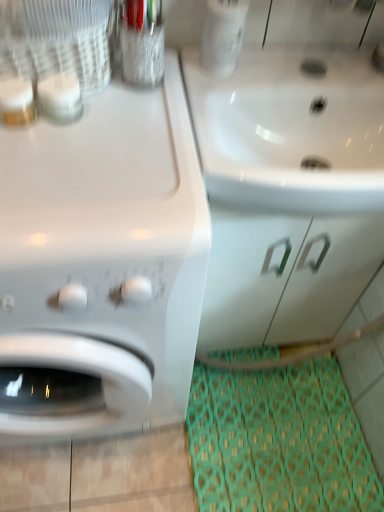
Question: Does point (225, 440) appear closer or farther from the camera than point (74, 367)?

Choices:
 (A) farther
 (B) closer

Answer: (A)

Question: From the image's perspective, is green fabric doormat at lower right above or below white glossy washing machine at left?

Choices:
 (A) below
 (B) above

Answer: (A)

Question: Considering the real-world distances, which object is farthest from the white glossy drawer at center?

Choices:
 (A) green fabric doormat at lower right
 (B) white glossy sink at upper right
 (C) white glossy washing machine at left

Answer: (C)

Question: Which object is positioned farthest from the white glossy sink at upper right?

Choices:
 (A) white glossy drawer at center
 (B) green fabric doormat at lower right
 (C) white glossy washing machine at left

Answer: (B)